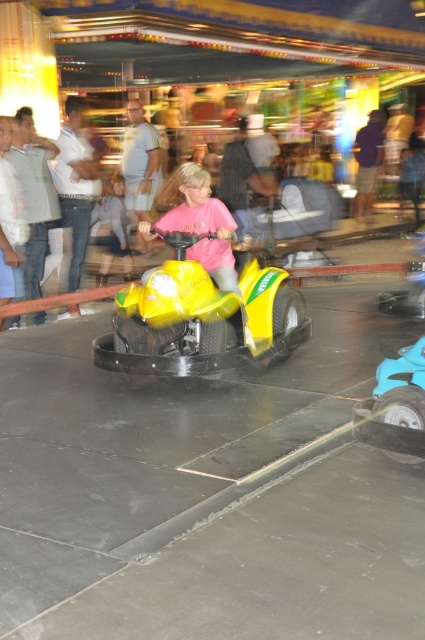
You are a photographer at the amusement park and want to capture a photo of the blue rubber toy car at lower right. Where exactly should you position your camera to ensure it is in the frame?

The blue rubber toy car at lower right is located at point (x=396, y=406). Position your camera so that it captures this coordinate to include the blue rubber toy car at lower right in the frame.